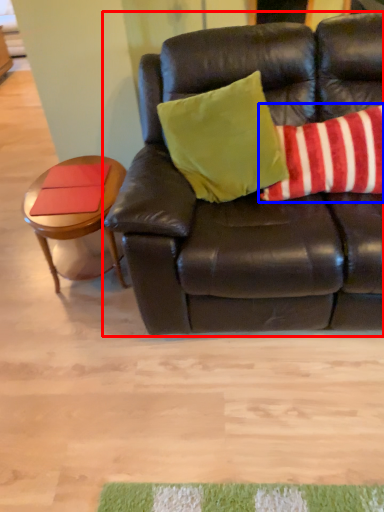
Question: Which of the following is the farthest to the observer, studio couch (highlighted by a red box) or pillow (highlighted by a blue box)?

Choices:
 (A) studio couch
 (B) pillow

Answer: (B)